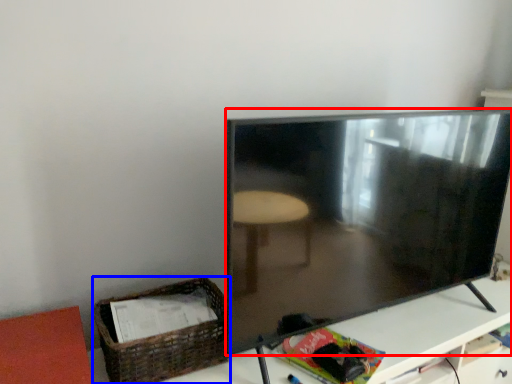
Question: Which point is closer to the camera, television (highlighted by a red box) or basket (highlighted by a blue box)?

Choices:
 (A) television
 (B) basket

Answer: (A)